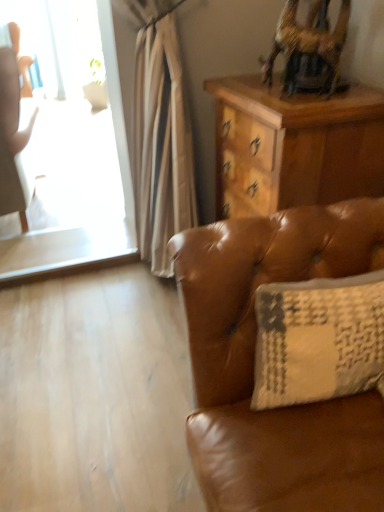
Locate an element on the screen. This screenshot has height=512, width=384. free space in front of wooden swivel chair at upper right is located at coordinates (303, 105).